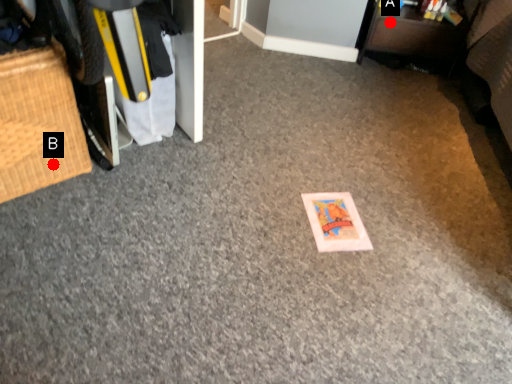
Question: Two points are circled on the image, labeled by A and B beside each circle. Which point is closer to the camera?

Choices:
 (A) A is closer
 (B) B is closer

Answer: (B)